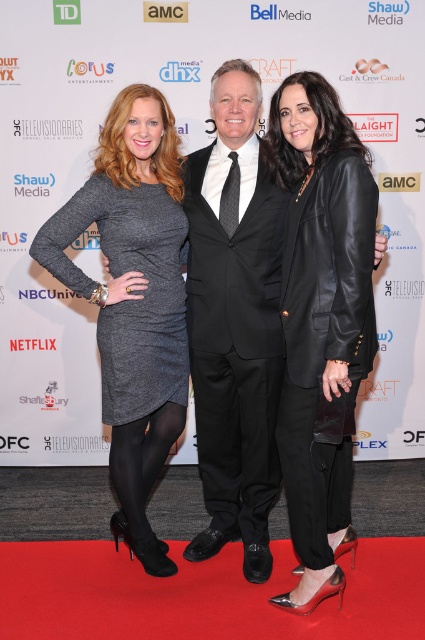
You are a photographer at the event and need to take a closeup shot of both the black leather blazer at center and the black satin suit at center. Can you fit both into the frame if your camera has a minimum focus distance of 12 inches?

The black leather blazer at center and black satin suit at center are 11.20 inches apart from each other, so yes, both can be captured in the frame as the distance between them is less than the camera minimum focus distance of 12 inches.

Consider the image. You are a photographer at the event and need to adjust your focus. Which item is closer to you between the black leather blazer at center and the gray knit dress at left?

The black leather blazer at center is closer to the viewer than the gray knit dress at left.